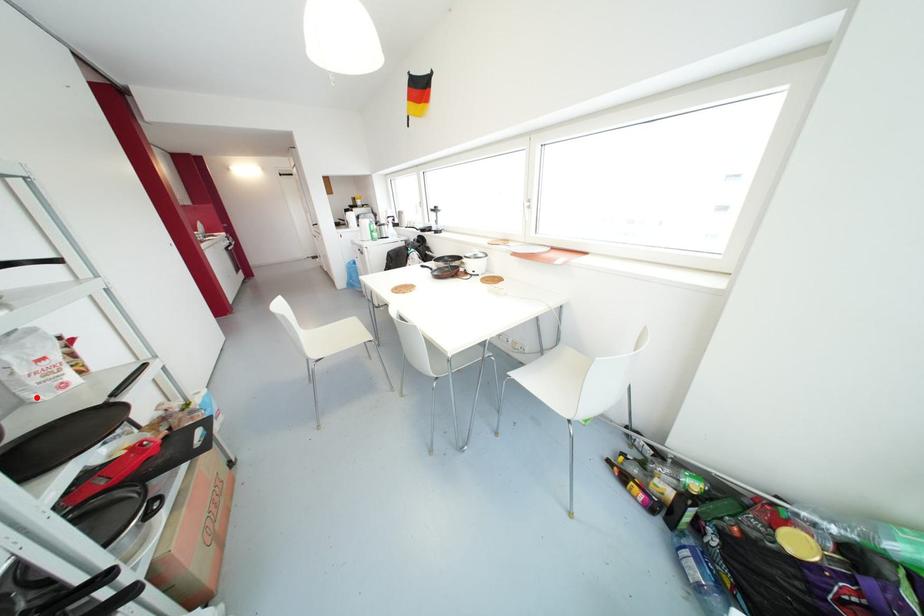
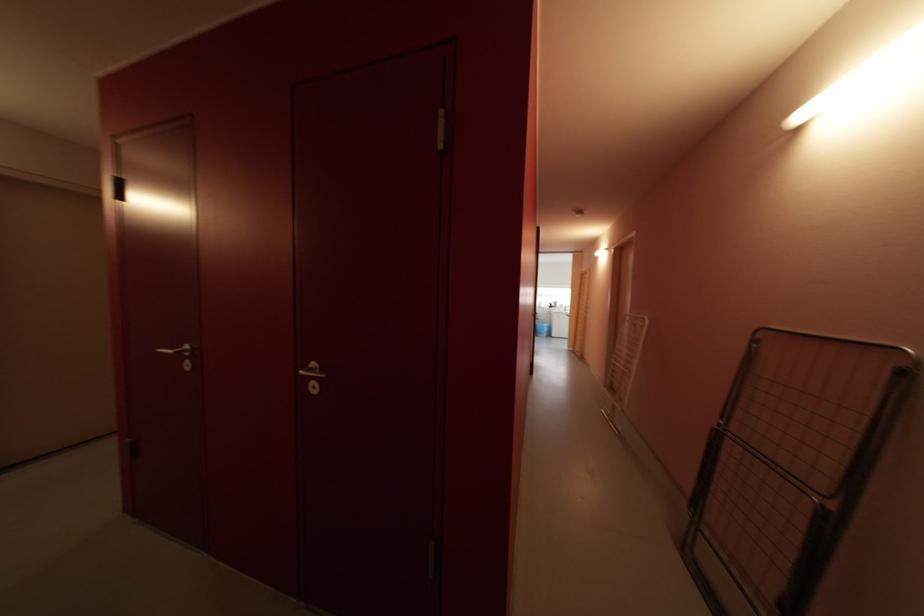
Question: I am providing you with two images of the same scene from different viewpoints. A red point is marked on the first image. At the location where the point appears in image 1, is it still visible in image 2?

Choices:
 (A) Yes
 (B) No

Answer: (B)